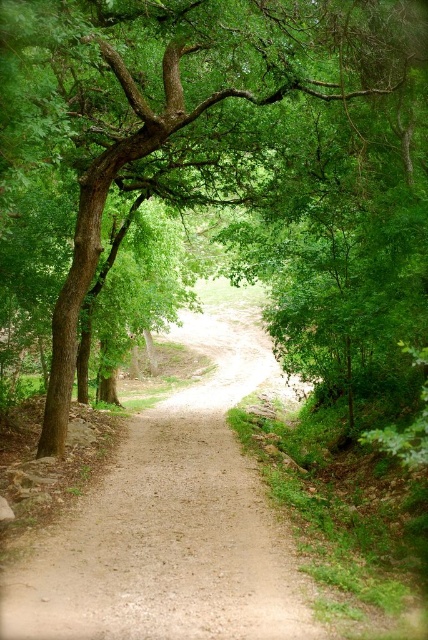
You are a hiker walking along the dirt path at center. You want to take a photo of the green leafy tree at center. Which side of the path should you stand on to get the best view of the tree?

The green leafy tree at center is positioned on the left side of the dirt path at center. To get the best view of the tree, you should stand on the right side of the path, opposite the tree, to avoid obstruction from the dense vegetation on the left side.

From the picture: You are a hiker standing at the start of the dirt path at center. You want to reach the green leafy tree at center. Is the tree closer to you or further away compared to the path?

The green leafy tree at center is further to the viewer than the dirt path at center, so the tree is further away from you compared to the path.